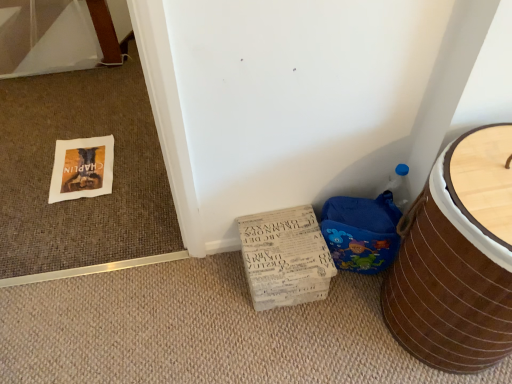
Question: Is blue fabric potty at lower right situated inside white cardboard box at lower center or outside?

Choices:
 (A) inside
 (B) outside

Answer: (B)

Question: Is blue fabric potty at lower right taller or shorter than white cardboard box at lower center?

Choices:
 (A) short
 (B) tall

Answer: (B)

Question: Which is nearer to the brown woven basket at lower right?

Choices:
 (A) blue fabric potty at lower right
 (B) white cardboard box at lower center

Answer: (A)

Question: Estimate the real-world distances between objects in this image. Which object is closer to the brown woven basket at lower right?

Choices:
 (A) white cardboard box at lower center
 (B) blue fabric potty at lower right

Answer: (B)